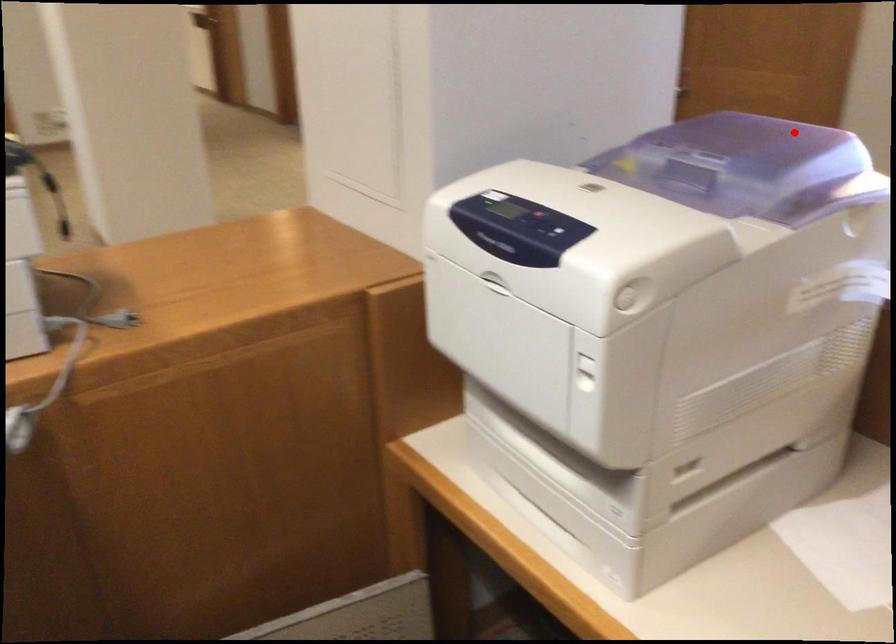
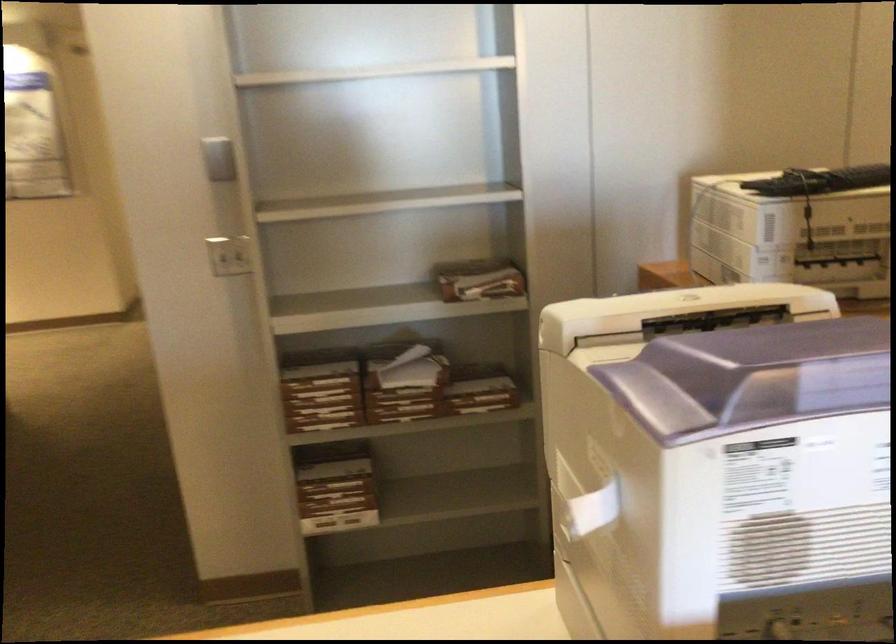
Question: A red point is marked in image1. In image2, is the corresponding 3D point closer to the camera or farther? Reply with the corresponding letter.

Choices:
 (A) The corresponding 3D point is closer.
 (B) The corresponding 3D point is farther.

Answer: (A)